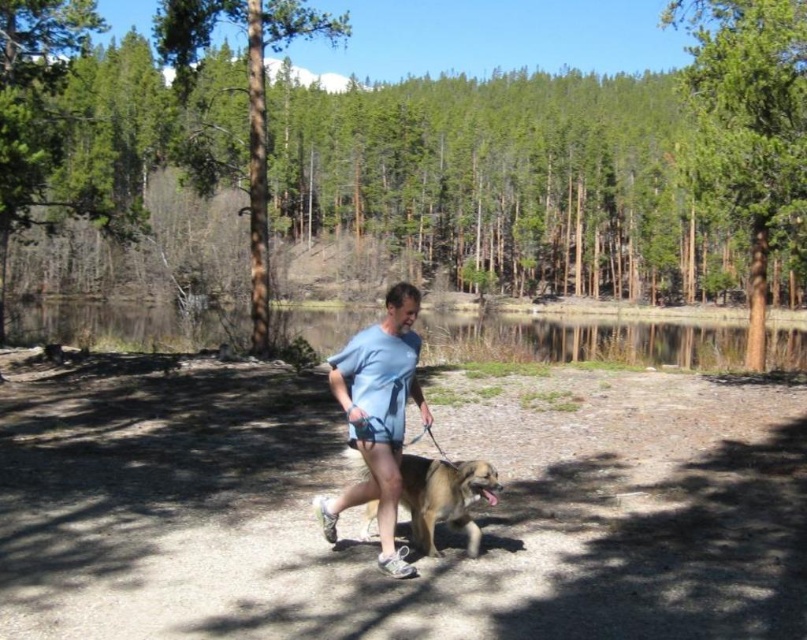
You are planning to set up a small tent on the smooth dirt path at center and the light blue fabric at center. Which location would be more suitable for the tent based on the size of the objects?

The smooth dirt path at center has a larger size compared to the light blue fabric at center, so the smooth dirt path at center is more suitable for setting up the tent.

You are a hiker trying to follow the trail marked by the smooth dirt path at center. You notice a light blue fabric at center nearby. Which direction should you turn to stay on the path?

The smooth dirt path at center is positioned on the right side of the light blue fabric at center, so you should turn to your right to stay on the path.

You are a hiker who wants to take a photo of the light blue fabric at center and the green rough bark tree at center. Which object should you focus on first if you want to capture both in the same frame without moving your camera?

The green rough bark tree at center is positioned over the light blue fabric at center, so you should focus on the tree first to ensure both are in focus since it is closer to the camera.